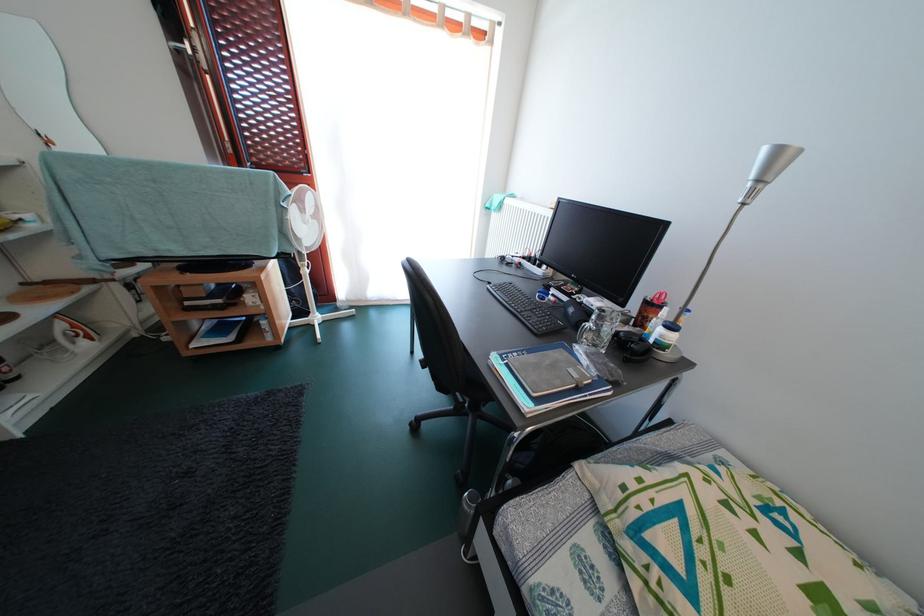
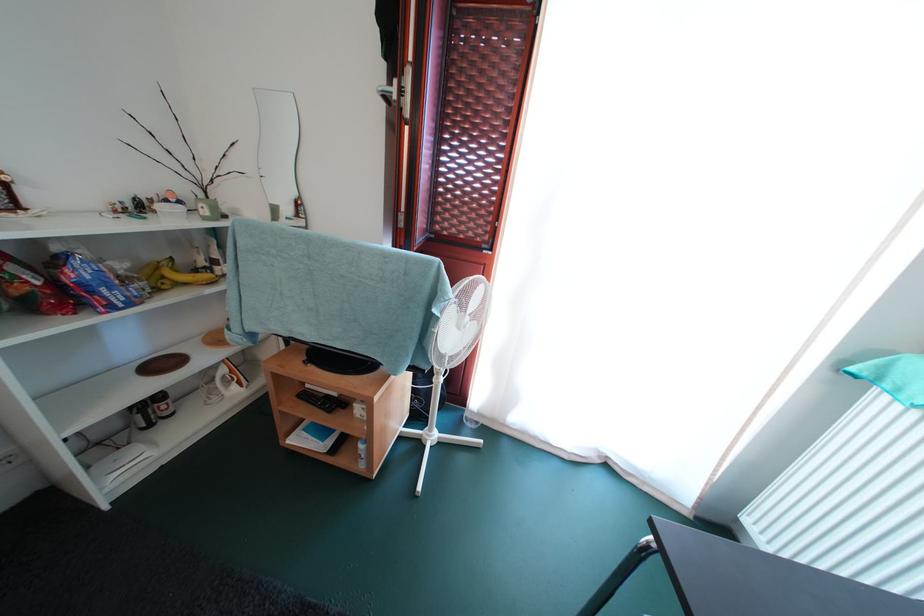
Locate, in the second image, the point that corresponds to [195,309] in the first image.

(314, 391)